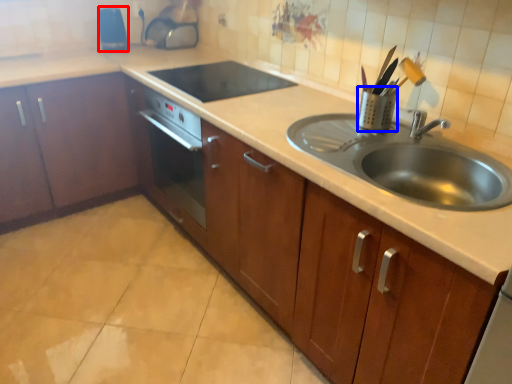
Question: Which object is closer to the camera taking this photo, appliance (highlighted by a red box) or appliance (highlighted by a blue box)?

Choices:
 (A) appliance
 (B) appliance

Answer: (B)